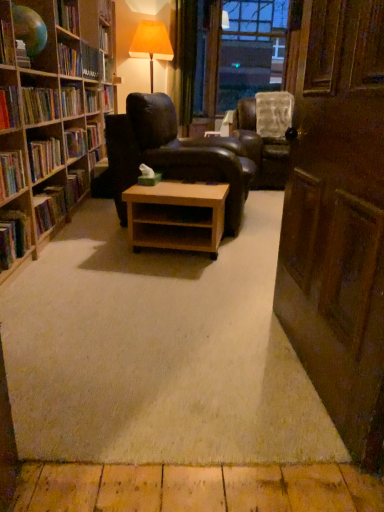
Where is `blank space to the left of wooden door at right`? This screenshot has width=384, height=512. blank space to the left of wooden door at right is located at coordinates (177, 366).